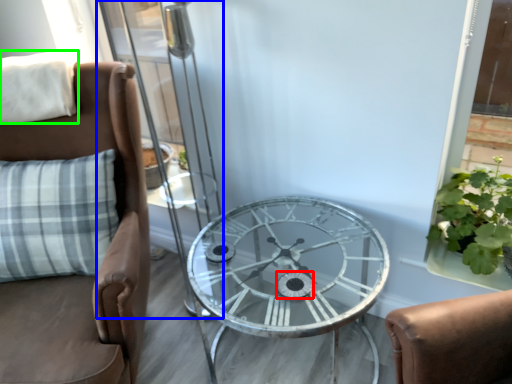
Question: Which object is positioned farthest from oval (highlighted by a red box)? Select from screen door (highlighted by a blue box) and pillow (highlighted by a green box).

Choices:
 (A) screen door
 (B) pillow

Answer: (A)